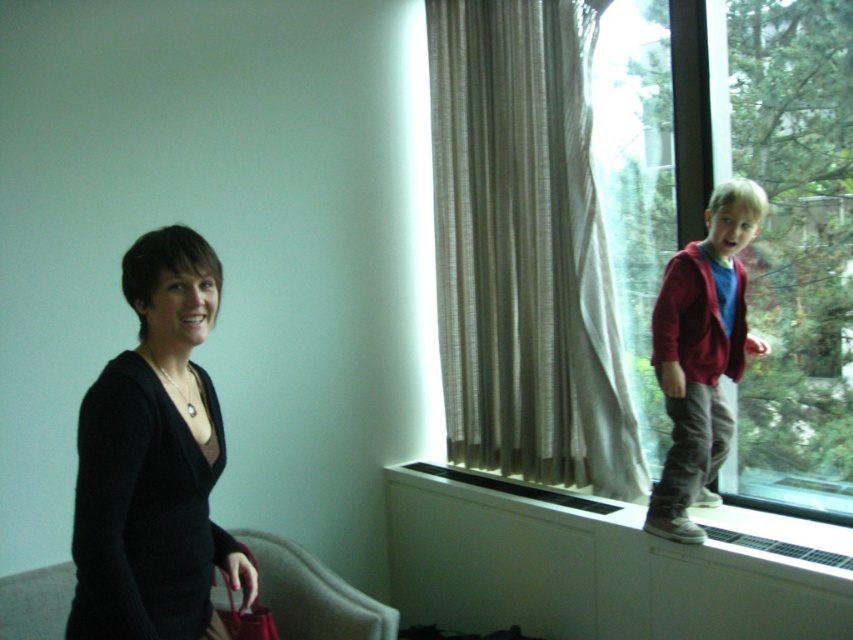
Question: Among these points, which one is farthest from the camera?

Choices:
 (A) (633, 28)
 (B) (527, 227)

Answer: (B)

Question: Which of the following is the farthest from the observer?

Choices:
 (A) (294, 596)
 (B) (762, 42)

Answer: (B)

Question: Which of the following is the farthest from the observer?

Choices:
 (A) clear glass window at right
 (B) black matte sweater at left

Answer: (A)

Question: Can you confirm if clear glass window at right is positioned to the left of black matte sweater at left?

Choices:
 (A) no
 (B) yes

Answer: (A)

Question: Can you confirm if black matte sweater at left is positioned to the right of velvet beige armchair at lower left?

Choices:
 (A) no
 (B) yes

Answer: (A)

Question: Does black matte sweater at left have a greater width compared to velvet beige armchair at lower left?

Choices:
 (A) yes
 (B) no

Answer: (B)